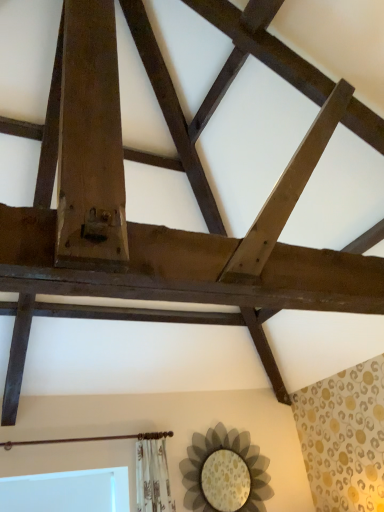
Image resolution: width=384 pixels, height=512 pixels. Describe the element at coordinates (231, 450) in the screenshot. I see `metallic silver mirror at lower center` at that location.

You are a GUI agent. You are given a task and a screenshot of the screen. Output one action in this format:
    pyautogui.click(x=<x>, y=<y>)
    Task: Click on the metallic silver mirror at lower center
    The image size is (384, 512).
    Given the screenshot: What is the action you would take?
    pyautogui.click(x=231, y=450)

Identify the location of metallic silver mirror at lower center. This screenshot has width=384, height=512. (231, 450).